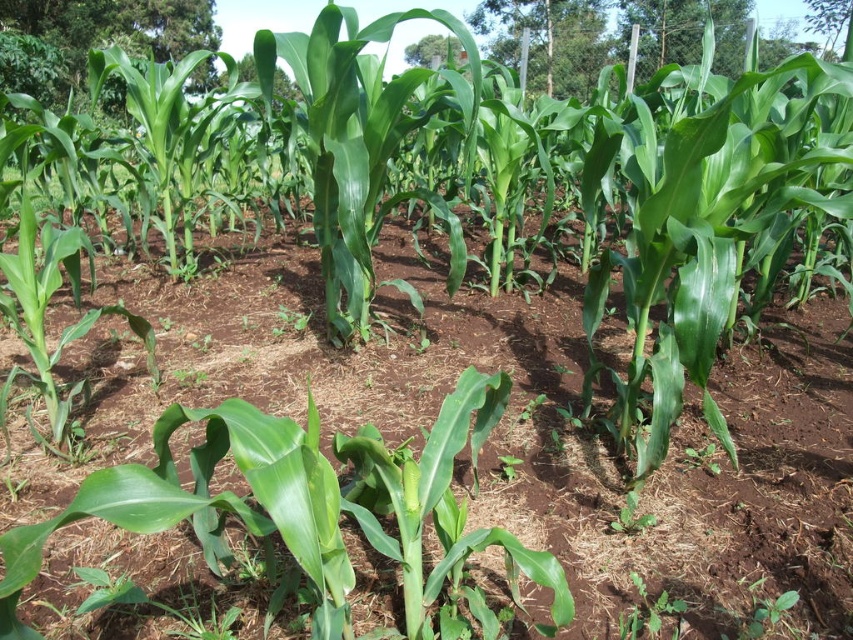
Question: Which object is positioned closest to the brown soil at center?

Choices:
 (A) green leafy plant at lower center
 (B) green leafy plant at center

Answer: (A)

Question: Which is nearer to the green leafy plant at lower center?

Choices:
 (A) green leafy plant at center
 (B) green glossy corn at center
 (C) brown soil at center

Answer: (A)

Question: Can you confirm if green leafy plant at lower center is positioned below green leafy plant at center?

Choices:
 (A) no
 (B) yes

Answer: (B)

Question: Is brown soil at center smaller than green leafy plant at center?

Choices:
 (A) no
 (B) yes

Answer: (A)

Question: Which of the following is the closest to the observer?

Choices:
 (A) green leafy plant at center
 (B) green leafy plant at lower center
 (C) green glossy corn at center
 (D) brown soil at center

Answer: (D)

Question: Does brown soil at center have a larger size compared to green glossy corn at center?

Choices:
 (A) yes
 (B) no

Answer: (A)